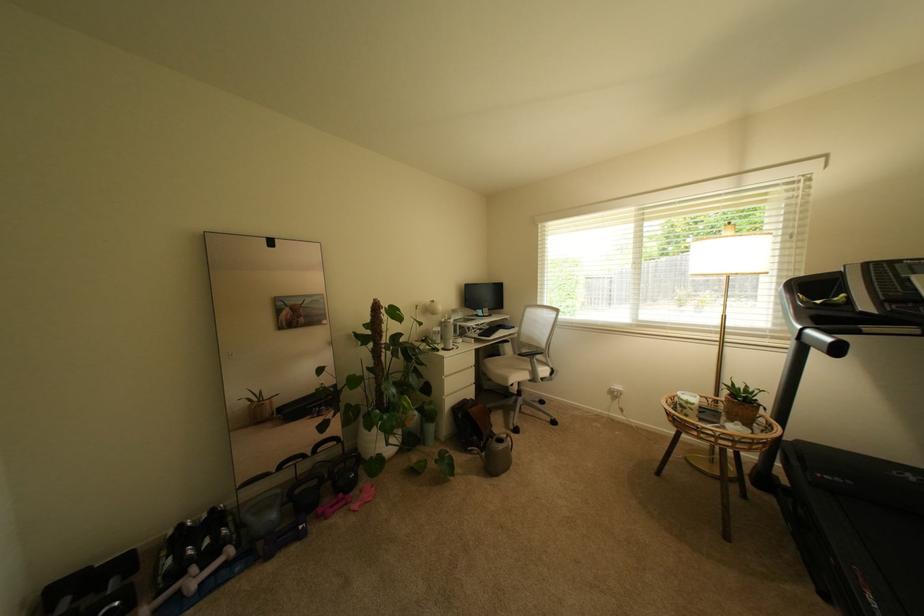
Describe the element at coordinates (517, 392) in the screenshot. The height and width of the screenshot is (616, 924). I see `the white chair armrest` at that location.